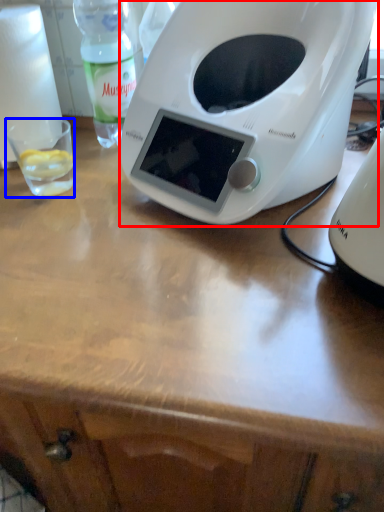
Question: Among these objects, which one is nearest to the camera, toaster (highlighted by a red box) or coffee cup (highlighted by a blue box)?

Choices:
 (A) toaster
 (B) coffee cup

Answer: (A)